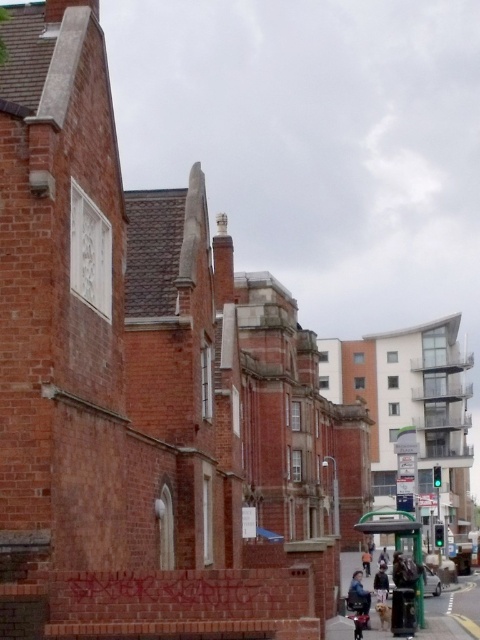
You are a delivery person standing at the edge of the street in front of the large red brick building. You need to deliver a package to the dark brown leather jacket at center and then to the orange cotton shirt at center. Can you deliver both packages without moving more than 40 meters from your starting position?

The dark brown leather jacket at center and orange cotton shirt at center are 38.10 meters apart. Since the distance between them is less than 40 meters, you can deliver both packages without exceeding the 40 meter limit from your starting position.

You are a delivery person trying to find the green plastic bus stop at center. According to the map, your current position is at point 0.825, 0.821. Is the bus stop directly in front of you?

The green plastic bus stop at center is located at point (x=394, y=528), which matches your current position. Therefore, you are already at the bus stop.